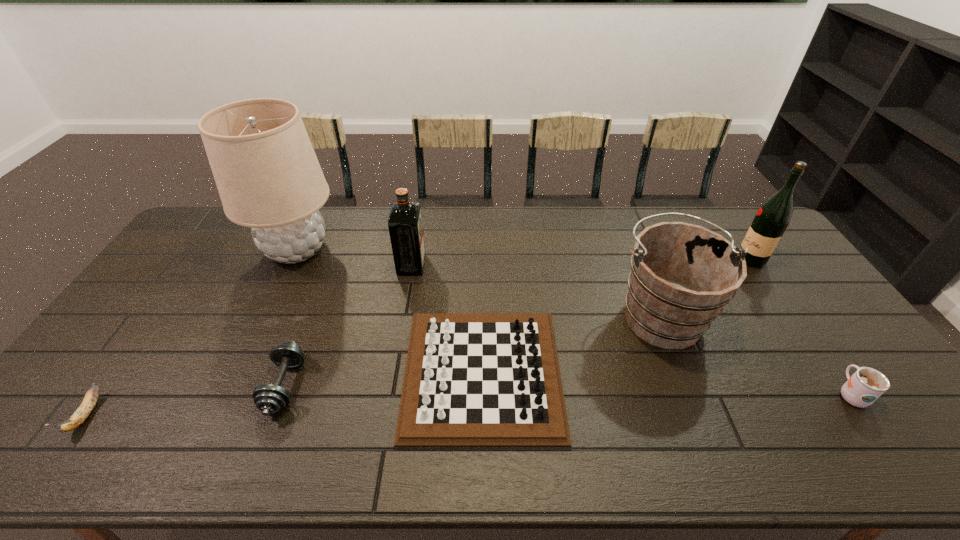
You are a GUI agent. You are given a task and a screenshot of the screen. Output one action in this format:
    pyautogui.click(x=<x>, y=<y>)
    Task: Click on the vacant area situated on the right of the dumbbell
    
    Given the screenshot: What is the action you would take?
    451,386

The height and width of the screenshot is (540, 960). Identify the location of free spot located on the right of the gameboard. (666, 373).

Locate an element on the screen. This screenshot has width=960, height=540. object located at the far edge is located at coordinates (268, 177).

Locate an element on the screen. gameboard that is at the near edge is located at coordinates (471, 379).

You are a GUI agent. You are given a task and a screenshot of the screen. Output one action in this format:
    pyautogui.click(x=<x>, y=<y>)
    Task: Click on the banana that is at the near edge
    This screenshot has width=960, height=540.
    Given the screenshot: What is the action you would take?
    pyautogui.click(x=81, y=414)

Locate an element on the screen. The image size is (960, 540). object that is at the left edge is located at coordinates (81, 414).

This screenshot has width=960, height=540. In order to click on liquor that is at the right edge in this screenshot , I will do `click(773, 217)`.

Identify the location of cup that is at the right edge. (866, 385).

I want to click on object situated at the near left corner, so click(81, 414).

You are a GUI agent. You are given a task and a screenshot of the screen. Output one action in this format:
    pyautogui.click(x=<x>, y=<y>)
    Task: Click on the free region at the far edge of the desktop
    Image resolution: width=960 pixels, height=540 pixels.
    Given the screenshot: What is the action you would take?
    pyautogui.click(x=434, y=245)